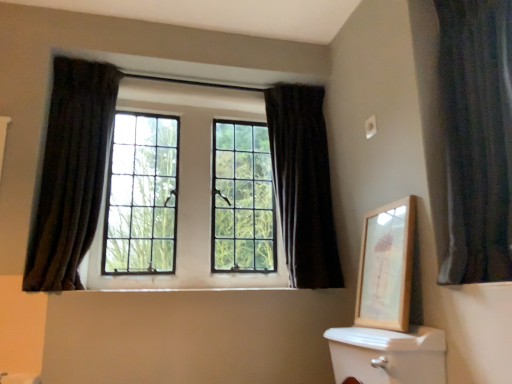
Identify the location of blank space above dark velvet curtain at left, positioned as the 1th curtain in left-to-right order (from a real-world perspective). This screenshot has height=384, width=512. (95, 51).